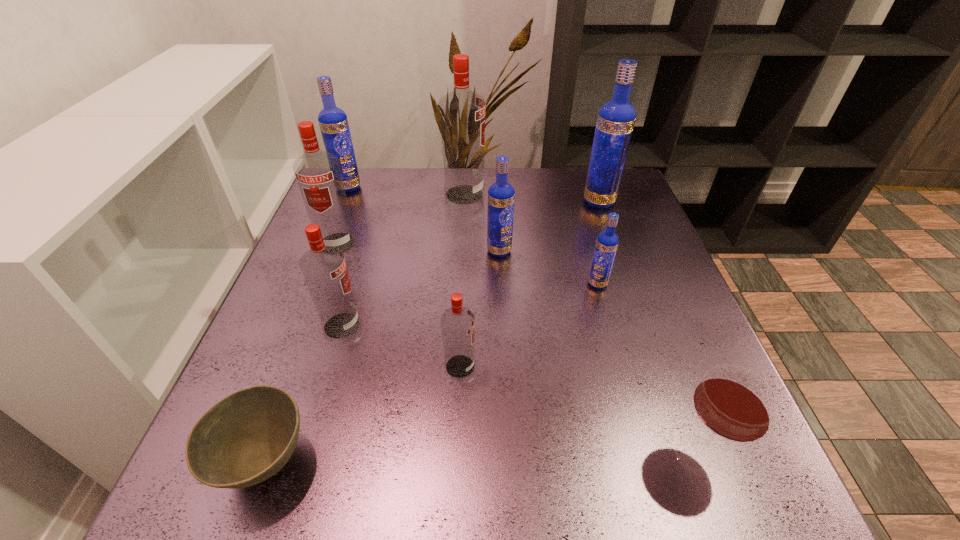
I want to click on the closest vodka to the sixth farthest object, so click(501, 195).

Identify the location of the fourth closest red vodka to the third farthest blue vodka. This screenshot has height=540, width=960. (318, 174).

Select which red vodka appears as the second closest to the third farthest red vodka. Please provide its 2D coordinates. Your answer should be formatted as a tuple, i.e. [(x, y)], where the tuple contains the x and y coordinates of a point satisfying the conditions above.

[(318, 174)]

Find the location of a particular element. The image size is (960, 540). blue vodka that is the third nearest to the third biggest red vodka is located at coordinates (607, 242).

The height and width of the screenshot is (540, 960). I want to click on the third closest blue vodka relative to the seventh farthest object, so click(x=607, y=242).

Where is `vacant space that satisfies the following two spatial constraints: 1. on the front label of the second biggest red vodka; 2. on the right side of the second smallest blue vodka`? vacant space that satisfies the following two spatial constraints: 1. on the front label of the second biggest red vodka; 2. on the right side of the second smallest blue vodka is located at coordinates (334, 251).

This screenshot has width=960, height=540. Find the location of `blank space that satisfies the following two spatial constraints: 1. on the back side of the third biggest blue vodka; 2. on the front label of the farthest red vodka`. blank space that satisfies the following two spatial constraints: 1. on the back side of the third biggest blue vodka; 2. on the front label of the farthest red vodka is located at coordinates (496, 194).

You are a GUI agent. You are given a task and a screenshot of the screen. Output one action in this format:
    pyautogui.click(x=<x>, y=<y>)
    Task: Click on the free space that satisfies the following two spatial constraints: 1. on the front label of the nearest red vodka; 2. on the back side of the red wineglass
    
    Given the screenshot: What is the action you would take?
    pyautogui.click(x=457, y=455)